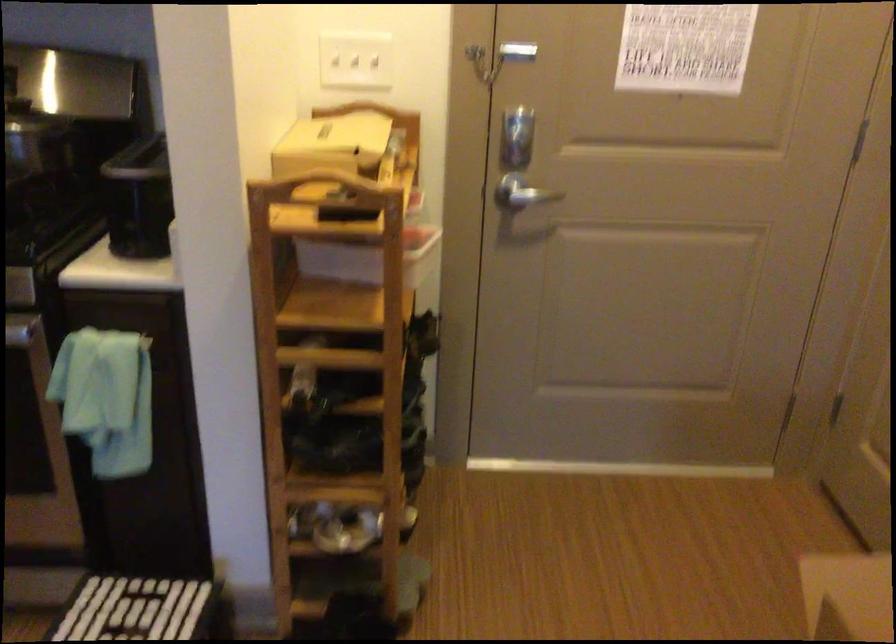
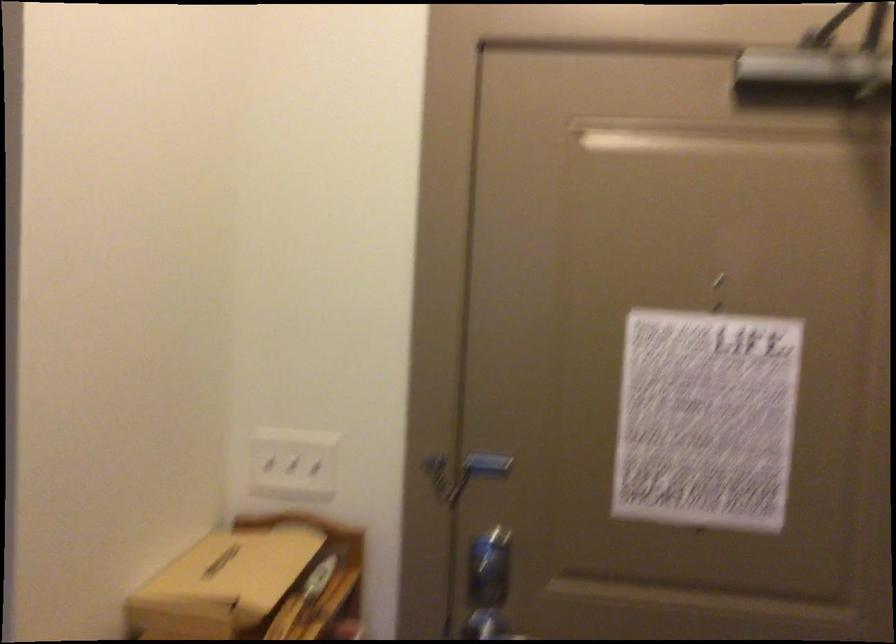
The images are taken continuously from a first-person perspective. In which direction are you moving?

The cameraman moved toward right, forward.